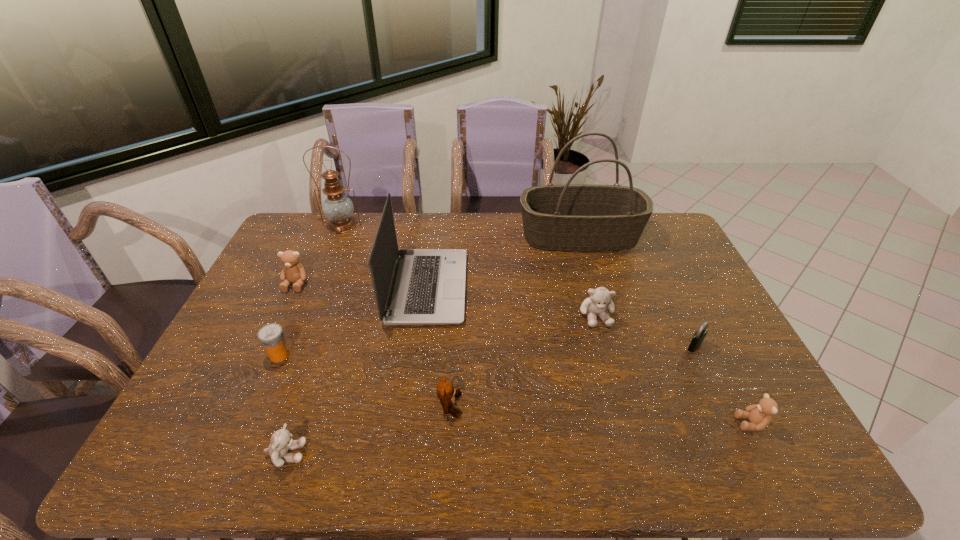
Find the location of `free space between the medicine and the black padlock`. free space between the medicine and the black padlock is located at coordinates (488, 350).

Where is `vacant point located between the laptop computer and the leftmost brown teddy bear`? Image resolution: width=960 pixels, height=540 pixels. vacant point located between the laptop computer and the leftmost brown teddy bear is located at coordinates (362, 286).

Identify the location of free point between the farthest teddy bear and the nearest teddy bear. The height and width of the screenshot is (540, 960). (292, 369).

Where is `free space between the farthest teddy bear and the orange medicine`? The width and height of the screenshot is (960, 540). free space between the farthest teddy bear and the orange medicine is located at coordinates (288, 319).

I want to click on vacant area that lies between the rightmost brown teddy bear and the left gray teddy bear, so click(x=519, y=438).

Locate an element on the screen. This screenshot has height=540, width=960. vacant area that lies between the black padlock and the basket is located at coordinates [x=637, y=291].

Where is `empty space that is in between the basket and the oil lamp`? empty space that is in between the basket and the oil lamp is located at coordinates (461, 231).

This screenshot has height=540, width=960. What are the coordinates of `vacant region between the padlock and the rightmost brown teddy bear` in the screenshot? It's located at (723, 384).

Where is `unoccupied area between the third tallest object and the black padlock`? This screenshot has height=540, width=960. unoccupied area between the third tallest object and the black padlock is located at coordinates (562, 316).

Identify which object is the eighth closest to the rightmost brown teddy bear. Please provide its 2D coordinates. Your answer should be formatted as a tuple, i.e. [(x, y)], where the tuple contains the x and y coordinates of a point satisfying the conditions above.

[(292, 272)]